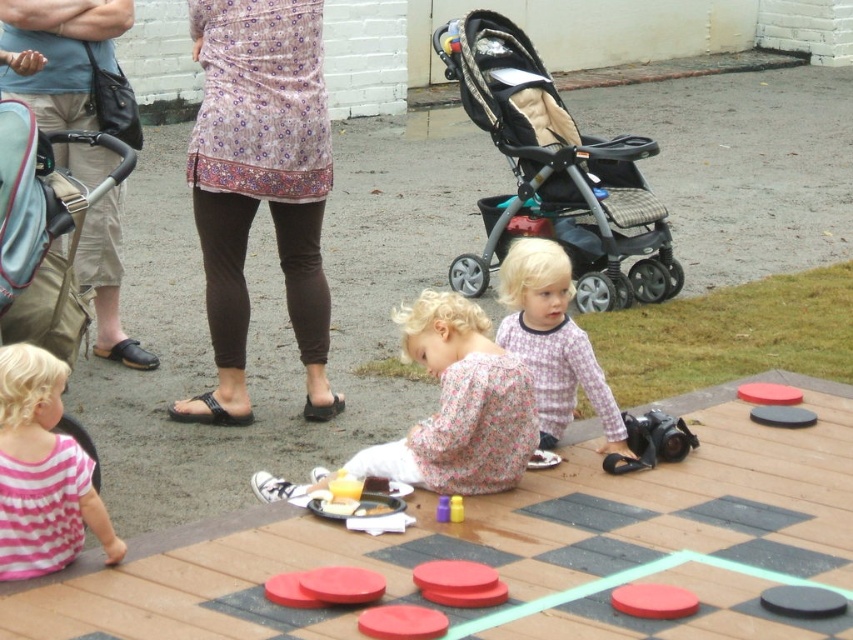
Is point (669, 609) positioned behind point (439, 497)?

No, (669, 609) is closer to viewer.

Between smooth plastic disc at lower right and yellow plastic cup at center, which one is positioned higher?

yellow plastic cup at center is above.

What are the coordinates of `smooth plastic disc at lower right` in the screenshot? It's located at (653, 600).

I want to click on smooth plastic disc at lower right, so click(x=653, y=600).

Looking at this image, who is more forward, [355,474] or [68,166]?

Point [355,474] is more forward.

Which is below, floral fabric dress at center or light blue cotton shirt at upper left?

Positioned lower is floral fabric dress at center.

Between point (474, 406) and point (68, 1), which one is positioned in front?

Point (474, 406)

The width and height of the screenshot is (853, 640). Identify the location of floral fabric dress at center. (457, 404).

Is pink striped fabric at lower left below smooth plastic disc at lower right?

Incorrect, pink striped fabric at lower left is not positioned below smooth plastic disc at lower right.

Which is more to the right, pink striped fabric at lower left or smooth plastic disc at lower right?

smooth plastic disc at lower right is more to the right.

Measure the distance between pink striped fabric at lower left and camera.

Answer: 17.00 feet

Where is `pink striped fabric at lower left`? pink striped fabric at lower left is located at coordinates (42, 472).